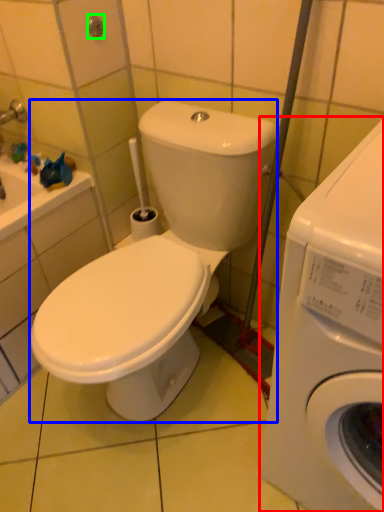
Question: Which object is the closest to the washing machine (highlighted by a red box)? Choose among these: washing machine (highlighted by a blue box) or shower (highlighted by a green box).

Choices:
 (A) washing machine
 (B) shower

Answer: (A)